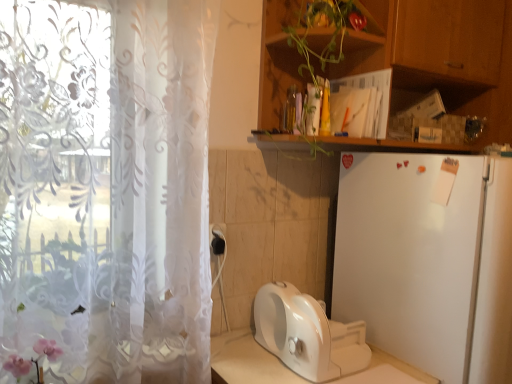
I want to click on pink floral decoration at lower left, so click(34, 363).

Describe the element at coordinates (218, 239) in the screenshot. I see `black plastic electric outlet at lower center` at that location.

This screenshot has width=512, height=384. I want to click on white matte refrigerator at right, so click(x=426, y=262).

Measure the distance between point (x=466, y=10) and camera.

1.48 meters.

The width and height of the screenshot is (512, 384). What do you see at coordinates (307, 334) in the screenshot? I see `white glossy toaster at lower center` at bounding box center [307, 334].

At what (x,y) coordinates should I click in order to perform the action: click on pink floral decoration at lower left. Please return your answer as a coordinate pair (x, y). Looking at the image, I should click on (34, 363).

Is white matte refrigerator at right in front of transparent floral curtain at left?

No.

Is white matte refrigerator at right oriented towards transparent floral curtain at left?

No.

Choose the correct answer: Is white matte refrigerator at right inside transparent floral curtain at left or outside it?

white matte refrigerator at right cannot be found inside transparent floral curtain at left.

Which object is thinner, white matte refrigerator at right or transparent floral curtain at left?

With smaller width is transparent floral curtain at left.

Considering the positions of objects wooden cabinet at upper right and black plastic electric outlet at lower center in the image provided, who is more to the right, wooden cabinet at upper right or black plastic electric outlet at lower center?

wooden cabinet at upper right.

Does point (286, 72) appear closer or farther from the camera than point (219, 227)?

Point (286, 72) is farther from the camera than point (219, 227).

Is wooden cabinet at upper right not near black plastic electric outlet at lower center?

No, wooden cabinet at upper right is in close proximity to black plastic electric outlet at lower center.

Looking at the image, does wooden cabinet at upper right seem bigger or smaller compared to black plastic electric outlet at lower center?

Clearly, wooden cabinet at upper right is larger in size than black plastic electric outlet at lower center.

Consider the image. Considering the relative sizes of white matte refrigerator at right and pink floral decoration at lower left in the image provided, is white matte refrigerator at right wider than pink floral decoration at lower left?

Yes, white matte refrigerator at right is wider than pink floral decoration at lower left.

Where is `flower lying below the white matte refrigerator at right (from the image's perspective)`? This screenshot has height=384, width=512. flower lying below the white matte refrigerator at right (from the image's perspective) is located at coordinates [x=34, y=363].

Can we say white matte refrigerator at right lies outside pink floral decoration at lower left?

white matte refrigerator at right lies outside pink floral decoration at lower left's area.

Is wooden cabinet at upper right far from pink floral decoration at lower left?

Indeed, wooden cabinet at upper right is not near pink floral decoration at lower left.

Based on the photo, considering the relative sizes of wooden cabinet at upper right and pink floral decoration at lower left in the image provided, is wooden cabinet at upper right smaller than pink floral decoration at lower left?

Actually, wooden cabinet at upper right might be larger than pink floral decoration at lower left.

Is wooden cabinet at upper right outside of pink floral decoration at lower left?

Yes, wooden cabinet at upper right is not within pink floral decoration at lower left.

How far apart are wooden cabinet at upper right and pink floral decoration at lower left?

wooden cabinet at upper right is 4.32 feet from pink floral decoration at lower left.

Does white matte refrigerator at right touch black plastic electric outlet at lower center?

No, white matte refrigerator at right is not next to black plastic electric outlet at lower center.

Which is more to the left, white matte refrigerator at right or black plastic electric outlet at lower center?

From the viewer's perspective, black plastic electric outlet at lower center appears more on the left side.

From their relative heights in the image, would you say white matte refrigerator at right is taller or shorter than black plastic electric outlet at lower center?

Considering their sizes, white matte refrigerator at right has more height than black plastic electric outlet at lower center.

How many degrees apart are the facing directions of white matte refrigerator at right and black plastic electric outlet at lower center?

The facing directions of white matte refrigerator at right and black plastic electric outlet at lower center are 1.2 degrees apart.

Can you tell me how much black plastic electric outlet at lower center and white matte refrigerator at right differ in facing direction?

black plastic electric outlet at lower center and white matte refrigerator at right are facing 1.2 degrees away from each other.

Which object is positioned more to the left, black plastic electric outlet at lower center or white matte refrigerator at right?

black plastic electric outlet at lower center.

From the image's perspective, is black plastic electric outlet at lower center above or below white matte refrigerator at right?

From the image's perspective, black plastic electric outlet at lower center appears above white matte refrigerator at right.

In the image, is black plastic electric outlet at lower center positioned in front of or behind white matte refrigerator at right?

In the image, black plastic electric outlet at lower center appears behind white matte refrigerator at right.

From a real-world perspective, is white glossy toaster at lower center over transparent floral curtain at left?

Incorrect, from a real-world perspective, white glossy toaster at lower center is lower than transparent floral curtain at left.

Is point (326, 373) closer to viewer compared to point (91, 172)?

That is False.

Could you tell me if white glossy toaster at lower center is turned towards transparent floral curtain at left?

No, white glossy toaster at lower center does not turn towards transparent floral curtain at left.

Which object is positioned more to the right, white glossy toaster at lower center or transparent floral curtain at left?

From the viewer's perspective, white glossy toaster at lower center appears more on the right side.

You are a GUI agent. You are given a task and a screenshot of the screen. Output one action in this format:
    pyautogui.click(x=<x>, y=<y>)
    Task: Click on the refrigerator that appears below the transparent floral curtain at left (from the image's perspective)
    
    Given the screenshot: What is the action you would take?
    pyautogui.click(x=426, y=262)

Where is `electric outlet on the left of wooden cabinet at upper right`? Image resolution: width=512 pixels, height=384 pixels. electric outlet on the left of wooden cabinet at upper right is located at coordinates (218, 239).

Based on their spatial positions, is white matte refrigerator at right or pink floral decoration at lower left closer to wooden cabinet at upper right?

white matte refrigerator at right lies closer to wooden cabinet at upper right than the other object.

Estimate the real-world distances between objects in this image. Which object is closer to black plastic electric outlet at lower center, pink floral decoration at lower left or transparent floral curtain at left?

Among the two, transparent floral curtain at left is located nearer to black plastic electric outlet at lower center.

Based on their spatial positions, is white matte refrigerator at right or black plastic electric outlet at lower center closer to transparent floral curtain at left?

Among the two, black plastic electric outlet at lower center is located nearer to transparent floral curtain at left.

When comparing their distances from wooden cabinet at upper right, does pink floral decoration at lower left or transparent floral curtain at left seem further?

pink floral decoration at lower left is further to wooden cabinet at upper right.

Which object lies further to the anchor point white glossy toaster at lower center, wooden cabinet at upper right or white matte refrigerator at right?

wooden cabinet at upper right lies further to white glossy toaster at lower center than the other object.

Based on their spatial positions, is black plastic electric outlet at lower center or transparent floral curtain at left closer to white glossy toaster at lower center?

black plastic electric outlet at lower center is closer to white glossy toaster at lower center.

Considering their positions, is white glossy toaster at lower center positioned closer to transparent floral curtain at left than pink floral decoration at lower left?

Among the two, pink floral decoration at lower left is located nearer to transparent floral curtain at left.

From the image, which object appears to be nearer to white glossy toaster at lower center, white matte refrigerator at right or wooden cabinet at upper right?

white matte refrigerator at right is closer to white glossy toaster at lower center.

Locate an element on the screen. The width and height of the screenshot is (512, 384). electric outlet located between pink floral decoration at lower left and wooden cabinet at upper right in the left-right direction is located at coordinates (218, 239).

Image resolution: width=512 pixels, height=384 pixels. I want to click on appliance situated between transparent floral curtain at left and white matte refrigerator at right from left to right, so click(x=307, y=334).

Where is `cabinetry between transparent floral curtain at left and white matte refrigerator at right`? cabinetry between transparent floral curtain at left and white matte refrigerator at right is located at coordinates (441, 57).

The height and width of the screenshot is (384, 512). Identify the location of electric outlet situated between pink floral decoration at lower left and white glossy toaster at lower center from left to right. (218, 239).